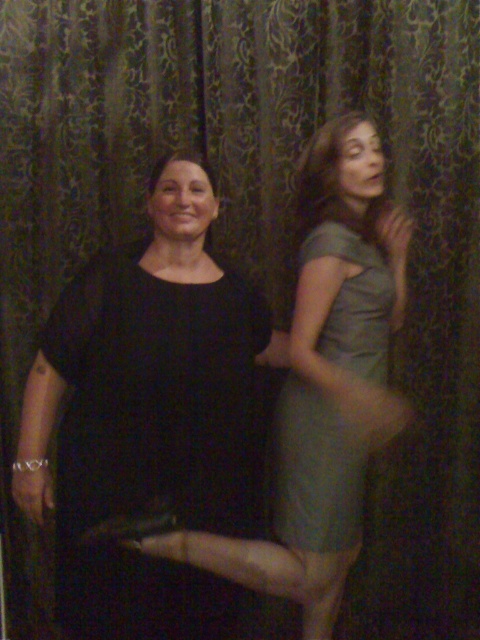
Question: Does matte gray dress at center have a larger size compared to satin green dress at right?

Choices:
 (A) no
 (B) yes

Answer: (B)

Question: Where is black matte dress at center located in relation to satin green dress at right in the image?

Choices:
 (A) above
 (B) below

Answer: (B)

Question: Which point is farther to the camera?

Choices:
 (A) black matte dress at center
 (B) matte gray dress at center
 (C) satin green dress at right
 (D) matte gray dress at right

Answer: (D)

Question: Can you confirm if satin green dress at right is thinner than matte gray dress at right?

Choices:
 (A) no
 (B) yes

Answer: (A)

Question: Which of these objects is positioned farthest from the satin green dress at right?

Choices:
 (A) matte gray dress at center
 (B) black matte dress at center

Answer: (B)

Question: Which of these objects is positioned farthest from the matte gray dress at right?

Choices:
 (A) satin green dress at right
 (B) black matte dress at center
 (C) matte gray dress at center

Answer: (B)